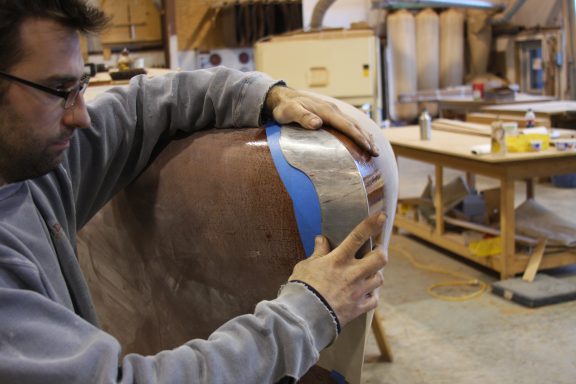
I want to click on floor, so click(446, 343).